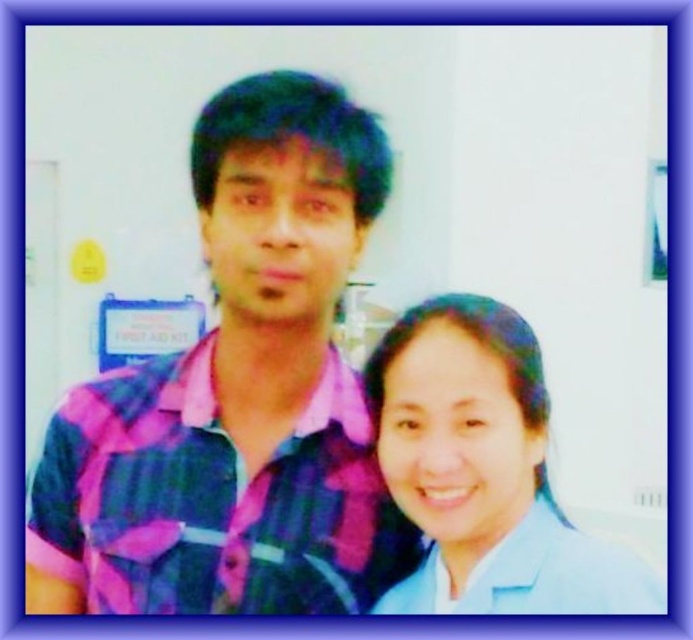
You are a delivery person who needs to place a 10 inch wide package between the pink plaid shirt at center and the blue fabric shirt at lower right. Can the package fit in the space between them?

The distance between the pink plaid shirt at center and the blue fabric shirt at lower right is 9.15 inches, which is narrower than the 10 inch wide package. The package cannot fit in the space between them.

You are an observer in the scene. You need to determine which person is shorter between the pink plaid shirt at center and the blue fabric shirt at lower right. Which one is shorter?

The pink plaid shirt at center is shorter than the blue fabric shirt at lower right.